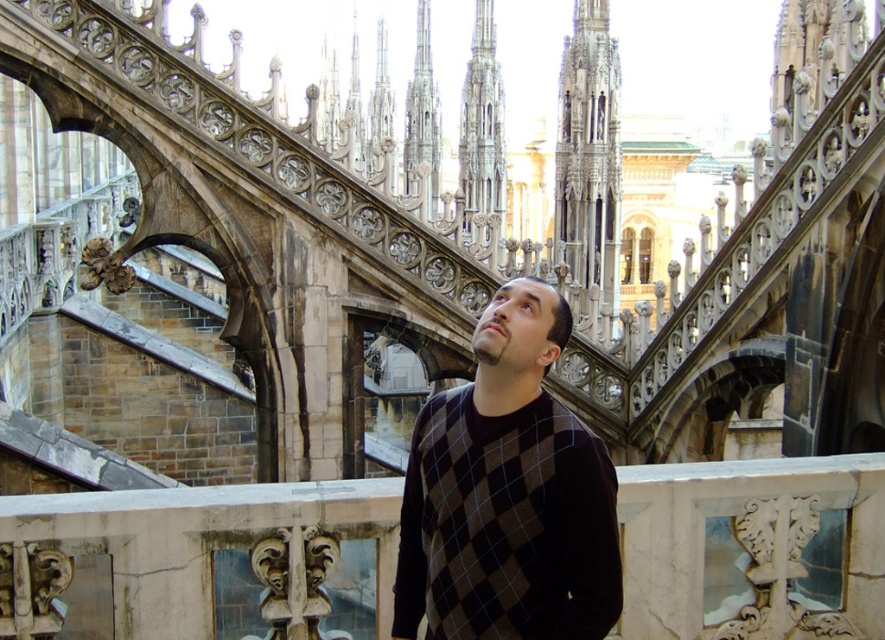
Between dark brown sweater at center and gray stone spire at upper center, which one is positioned lower?

Positioned lower is dark brown sweater at center.

Is dark brown sweater at center smaller than gray stone spire at upper center?

Yes.

Which is in front, point (483, 355) or point (422, 38)?

Point (483, 355)

Locate an element on the screen. dark brown sweater at center is located at coordinates (508, 493).

Image resolution: width=885 pixels, height=640 pixels. Describe the element at coordinates (589, 164) in the screenshot. I see `polished stone tower at center` at that location.

In order to click on polished stone tower at center in this screenshot , I will do `click(589, 164)`.

Can you confirm if dark brown sweater at center is positioned to the left of polished stone tower at center?

Correct, you'll find dark brown sweater at center to the left of polished stone tower at center.

Is dark brown sweater at center above polished stone tower at center?

Incorrect, dark brown sweater at center is not positioned above polished stone tower at center.

You are a GUI agent. You are given a task and a screenshot of the screen. Output one action in this format:
    pyautogui.click(x=<x>, y=<y>)
    Task: Click on the dark brown sweater at center
    
    Given the screenshot: What is the action you would take?
    (x=508, y=493)